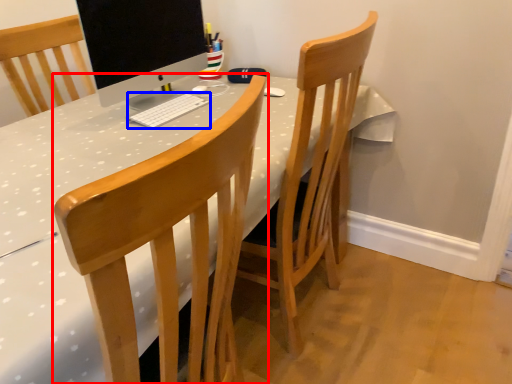
Question: Which of the following is the farthest to the observer, chair (highlighted by a red box) or computer keyboard (highlighted by a blue box)?

Choices:
 (A) chair
 (B) computer keyboard

Answer: (B)